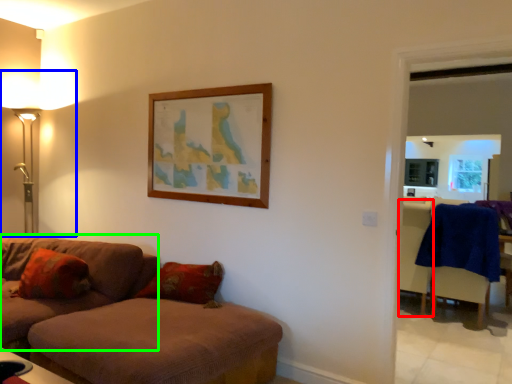
Question: Considering the real-world distances, which object is closest to armchair (highlighted by a red box)? table lamp (highlighted by a blue box) or studio couch (highlighted by a green box).

Choices:
 (A) table lamp
 (B) studio couch

Answer: (B)